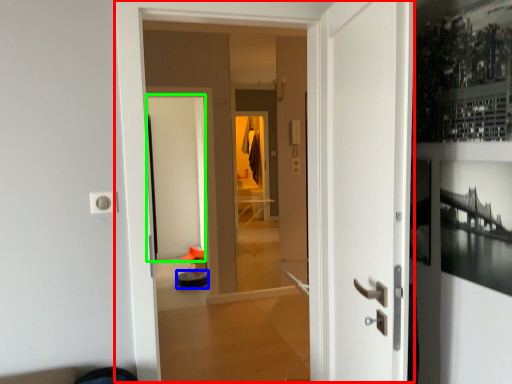
Question: Which object is the farthest from door (highlighted by a red box)? Choose among these: furniture (highlighted by a blue box) or screen door (highlighted by a green box).

Choices:
 (A) furniture
 (B) screen door

Answer: (B)